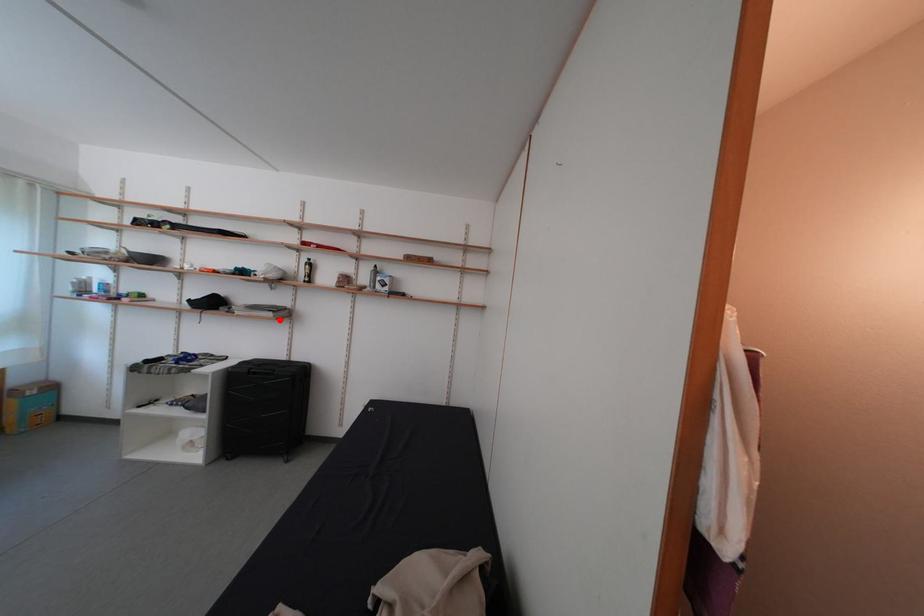
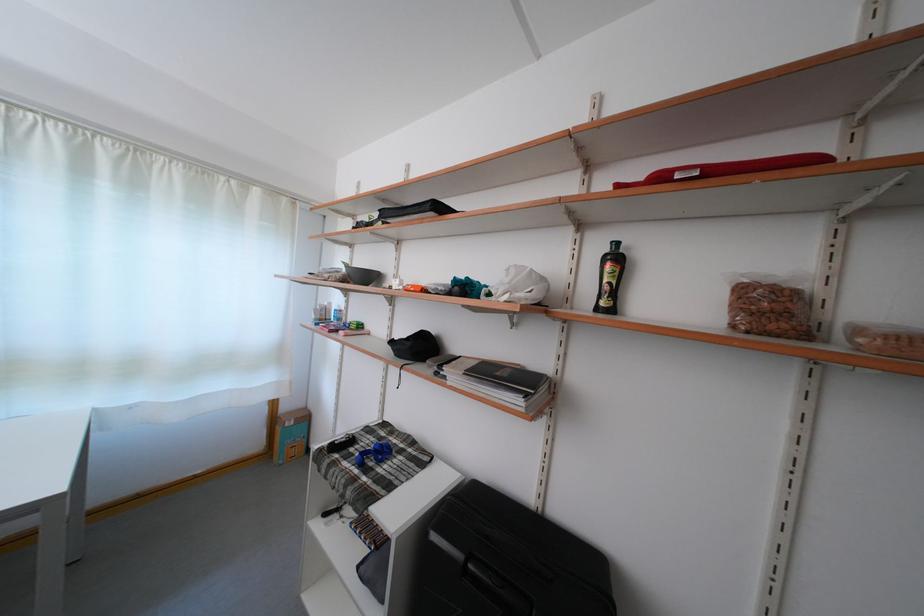
The point at the highlighted location is marked in the first image. Where is the corresponding point in the second image?

(527, 408)